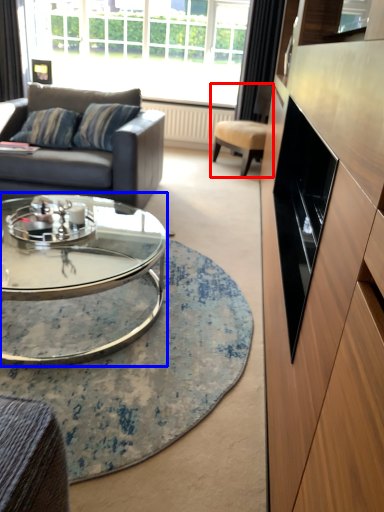
Question: Among these objects, which one is farthest to the camera, chair (highlighted by a red box) or coffee table (highlighted by a blue box)?

Choices:
 (A) chair
 (B) coffee table

Answer: (A)